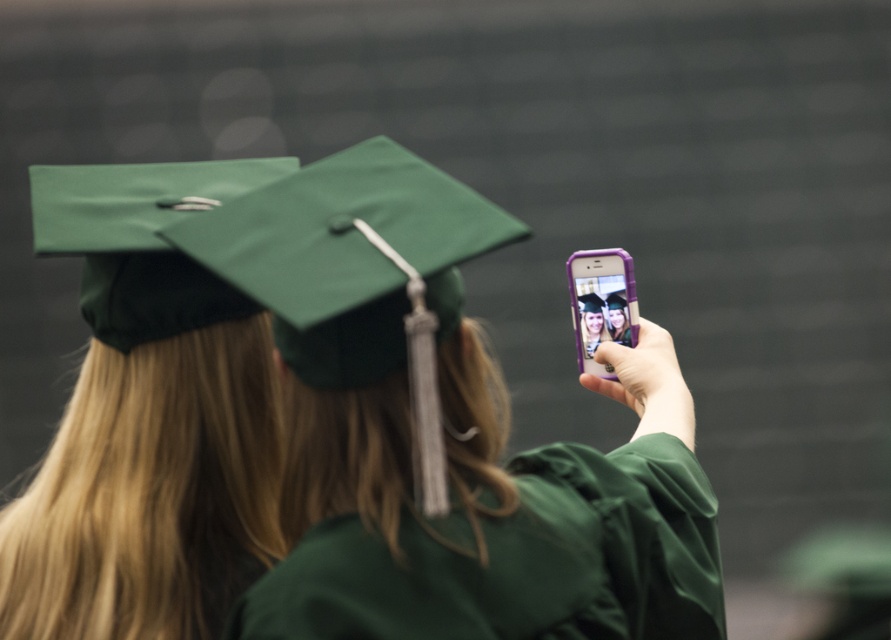
Who is taller, green matte graduation cap at upper left or green matte graduation robe at center?

Standing taller between the two is green matte graduation cap at upper left.

Where is `green matte graduation cap at upper left`? green matte graduation cap at upper left is located at coordinates (146, 419).

Where is `green matte graduation cap at upper left`? The image size is (891, 640). green matte graduation cap at upper left is located at coordinates (146, 419).

From the picture: Who is positioned more to the right, green matte graduation cap at center or green matte graduation robe at center?

green matte graduation cap at center is more to the right.

Who is more distant from viewer, (599, 557) or (626, 548)?

Positioned behind is point (626, 548).

Is point (440, 528) closer to viewer compared to point (544, 525)?

Yes, point (440, 528) is in front of point (544, 525).

Where is `green matte graduation cap at center`? The image size is (891, 640). green matte graduation cap at center is located at coordinates (447, 433).

Between point (385, 408) and point (226, 352), which one is positioned behind?

The point (226, 352) is behind.

Does green matte graduation cap at center appear on the left side of green matte graduation cap at upper left?

No, green matte graduation cap at center is not to the left of green matte graduation cap at upper left.

What are the coordinates of `green matte graduation cap at center` in the screenshot? It's located at (447, 433).